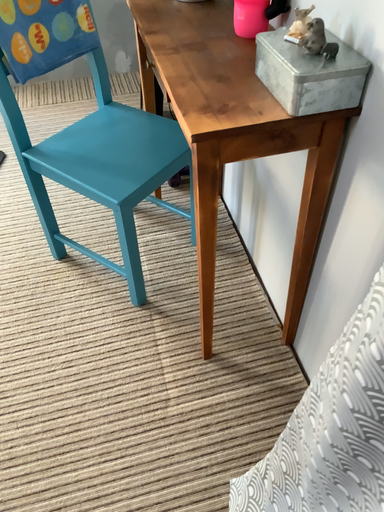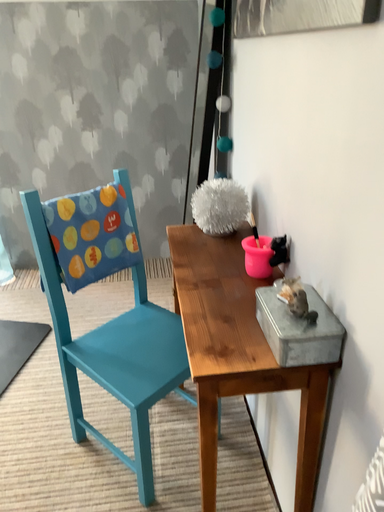
Question: How did the camera likely rotate when shooting the video?

Choices:
 (A) rotated upward
 (B) rotated downward

Answer: (A)